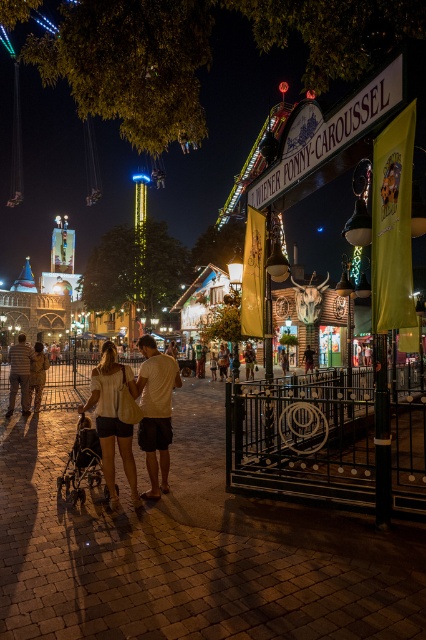
Who is taller, light beige shorts at center or light brown leather shorts at center?

Standing taller between the two is light beige shorts at center.

Identify the location of light beige shorts at center. (155, 410).

This screenshot has width=426, height=640. Find the location of `light beige shorts at center`. light beige shorts at center is located at coordinates (155, 410).

Locate an element on the screen. The image size is (426, 640). light beige cotton shirt at center is located at coordinates (114, 417).

Describe the element at coordinates (114, 417) in the screenshot. The width and height of the screenshot is (426, 640). I see `light beige cotton shirt at center` at that location.

Does point (169, 394) come closer to viewer compared to point (20, 339)?

Yes.

This screenshot has height=640, width=426. I want to click on light beige cotton shirt at center, so click(114, 417).

Does matte black stroller at lower left have a lesser width compared to light brown leather shorts at center?

In fact, matte black stroller at lower left might be wider than light brown leather shorts at center.

Is point (100, 470) closer to camera compared to point (247, 364)?

Yes, it is in front of point (247, 364).

Is point (117, 493) farther from camera compared to point (247, 358)?

No, (117, 493) is closer to viewer.

At what (x,y) coordinates should I click in order to perform the action: click on matte black stroller at lower left. Please return your answer as a coordinate pair (x, y). The width and height of the screenshot is (426, 640). Looking at the image, I should click on (81, 460).